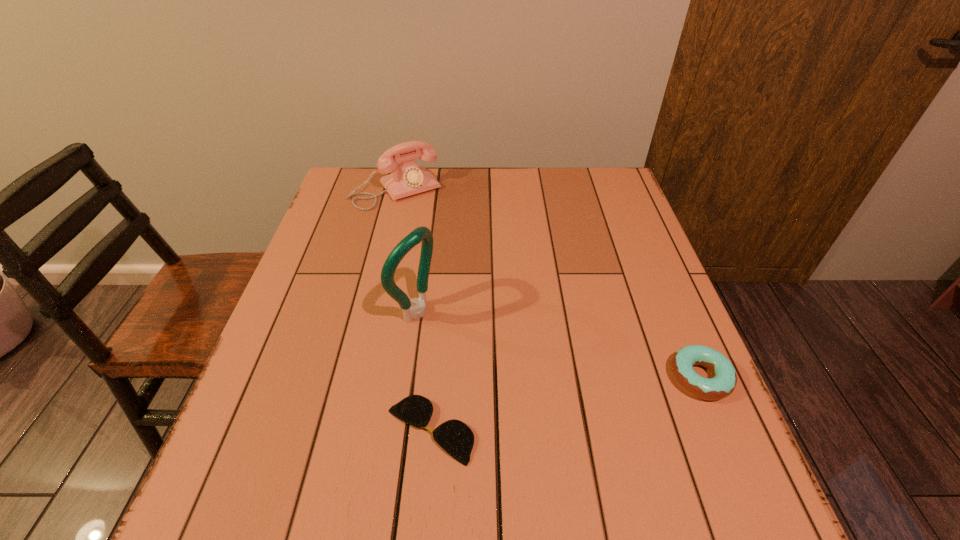
At what (x,y) coordinates should I click in order to perform the action: click on the shortest object. Please return your answer as a coordinate pair (x, y). This screenshot has height=540, width=960. Looking at the image, I should click on (455, 437).

The height and width of the screenshot is (540, 960). What are the coordinates of `the third tallest object` in the screenshot? It's located at (723, 383).

This screenshot has height=540, width=960. Find the location of `doughnut`. doughnut is located at coordinates (x=723, y=383).

This screenshot has height=540, width=960. I want to click on the third nearest object, so pyautogui.click(x=422, y=234).

I want to click on bottle opener, so click(x=422, y=234).

The width and height of the screenshot is (960, 540). In order to click on the third shortest object in this screenshot , I will do `click(409, 178)`.

Image resolution: width=960 pixels, height=540 pixels. I want to click on telephone, so click(x=409, y=178).

Where is `free space located on the right of the spectacles`? This screenshot has height=540, width=960. free space located on the right of the spectacles is located at coordinates pyautogui.click(x=618, y=430).

You are a GUI agent. You are given a task and a screenshot of the screen. Output one action in this format:
    pyautogui.click(x=<x>, y=<y>)
    Task: Click on the free spot located 0.210m on the left of the rightmost object
    The width and height of the screenshot is (960, 540).
    Given the screenshot: What is the action you would take?
    pyautogui.click(x=564, y=377)

You are a GUI agent. You are given a task and a screenshot of the screen. Output one action in this format:
    pyautogui.click(x=<x>, y=<y>)
    Task: Click on the vacant region located at the jaws of the tallest object
    Image resolution: width=960 pixels, height=540 pixels.
    Given the screenshot: What is the action you would take?
    pyautogui.click(x=490, y=354)